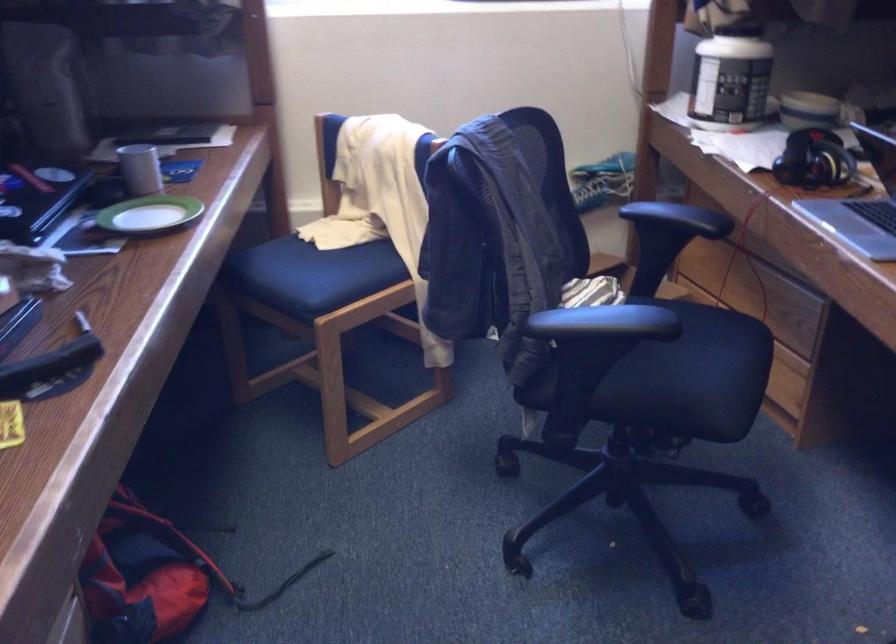
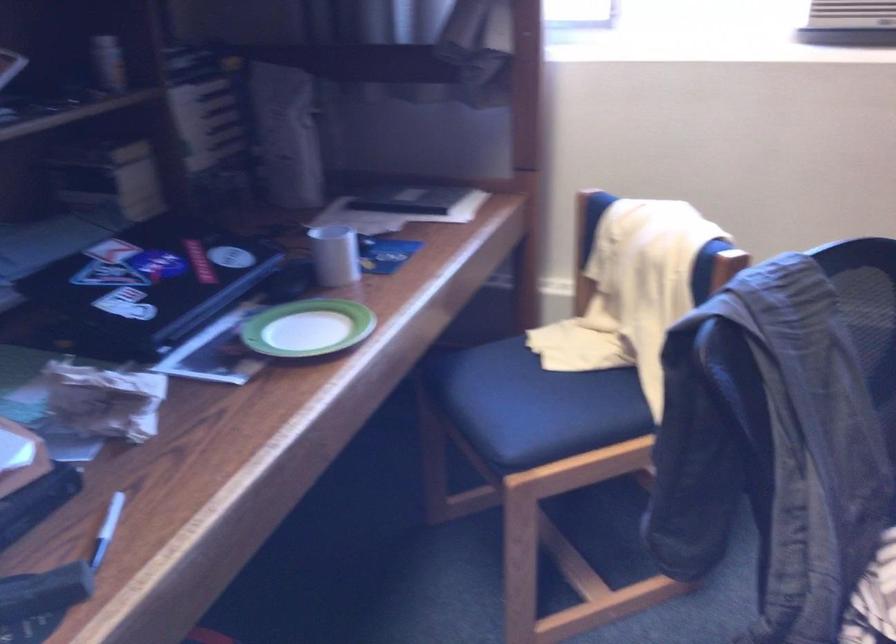
Question: The images are taken continuously from a first-person perspective. In which direction is your viewpoint rotating?

Choices:
 (A) Left
 (B) Right
 (C) Up
 (D) Down

Answer: (A)